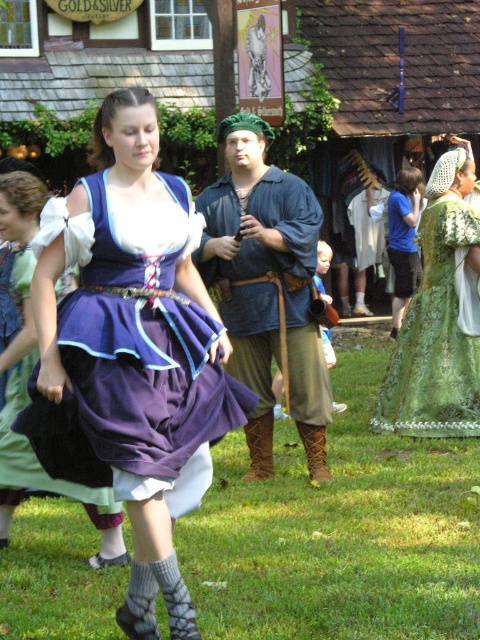
You are a drone operator trying to capture aerial footage of the Renaissance fair. Your drone is currently hovering at the coordinates given in the description. Where should you direct the drone to focus on the green grass at lower center?

The green grass at lower center is located at the 2D coordinates point (339,532), so you should direct the drone to focus on that point.

You are a costume designer observing the Renaissance fair scene. You need to determine the vertical positioning of the purple satin dress at center and the blue cotton shirt at center. Which one is positioned lower in the image?

The purple satin dress at center is positioned below the blue cotton shirt at center, so it is lower in the image.